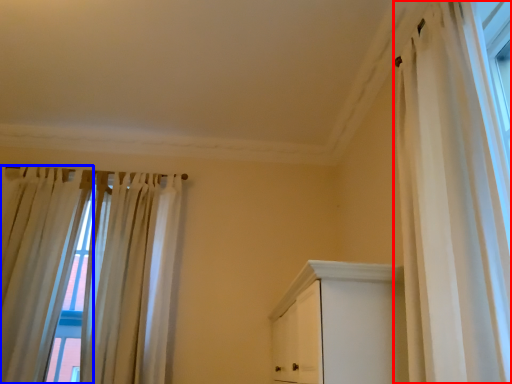
Question: Among these objects, which one is farthest to the camera, curtain (highlighted by a red box) or curtain (highlighted by a blue box)?

Choices:
 (A) curtain
 (B) curtain

Answer: (B)